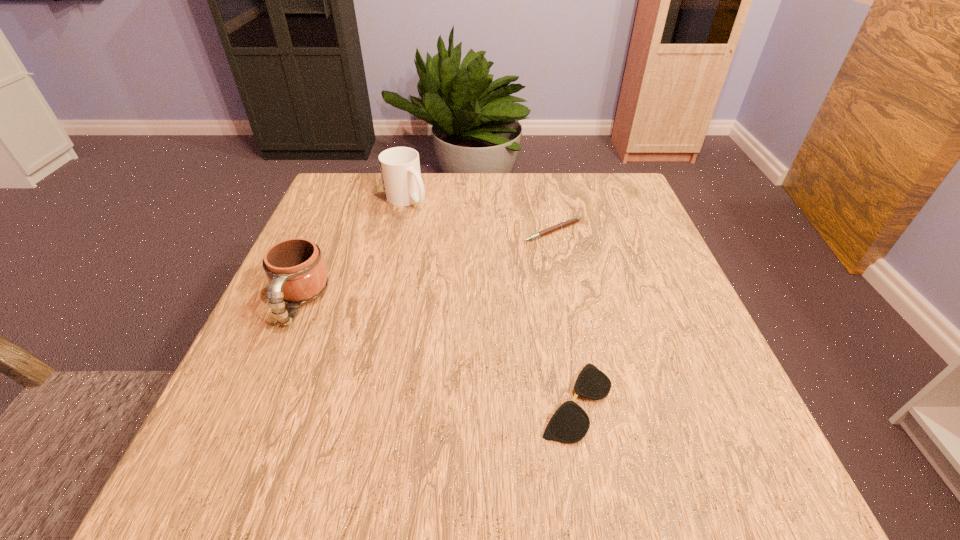
Identify the location of free space between the third shortest object and the nearest object. The height and width of the screenshot is (540, 960). (438, 352).

Where is `vacant point located between the farthest object and the third nearest object`? vacant point located between the farthest object and the third nearest object is located at coordinates (480, 215).

I want to click on free space between the pen and the spectacles, so click(x=564, y=316).

Select which object appears as the second closest to the pen. Please provide its 2D coordinates. Your answer should be formatted as a tuple, i.e. [(x, y)], where the tuple contains the x and y coordinates of a point satisfying the conditions above.

[(570, 423)]

What are the coordinates of `object that is the third nearest to the farther mug` in the screenshot? It's located at (570, 423).

The image size is (960, 540). Identify the location of free spot that satisfies the following two spatial constraints: 1. on the side of the shortest object with the handle; 2. on the left side of the shorter mug. (257, 401).

Identify the location of free space that satisfies the following two spatial constraints: 1. on the side of the shortest object with the handle; 2. on the right side of the shorter mug. This screenshot has height=540, width=960. (257, 401).